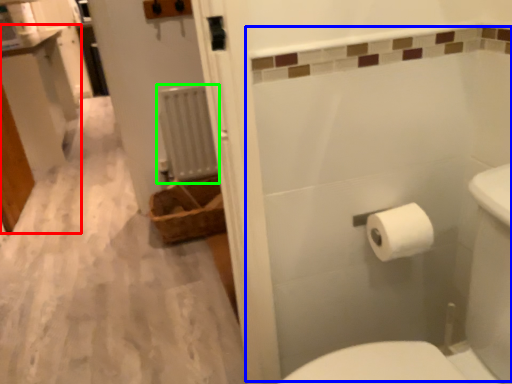
Question: Based on their relative distances, which object is nearer to vanity (highlighted by a red box)? Choose from bath (highlighted by a blue box) and radiator (highlighted by a green box).

Choices:
 (A) bath
 (B) radiator

Answer: (B)